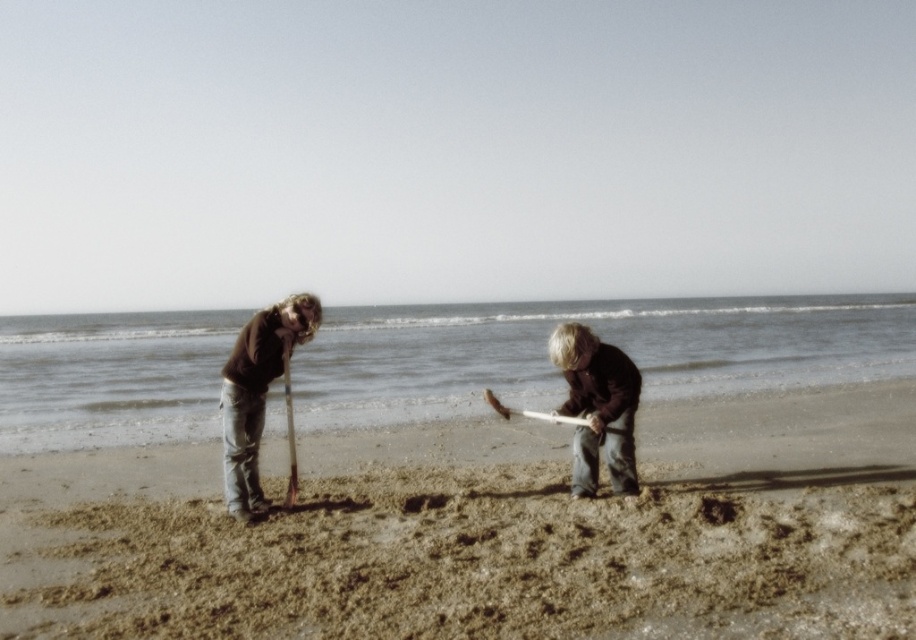
You are standing on the beach and see two points marked on the sand. The first point is at coordinates point (x=614, y=438) and the second is at point (x=249, y=465). If you were to walk from the first point to the second, would you be moving towards the ocean or away from it?

Since point (x=614, y=438) is in front of point (x=249, y=465), this means the first point is closer to the observer. Therefore, moving from the first point to the second would be moving away from the ocean towards the land.

You are standing at the shoreline and looking towards the ocean. There are two points marked on the beach, point 1 at coordinates point (435, 483) and point 2 at coordinates point (243, 496). Which point is closer to you?

Point 2 at coordinates point (243, 496) is closer to you because it is closer to the camera than point 1 at coordinates point (435, 483).

You are a visitor at the beach and want to know if the wooden stick at center can be fully buried in the brown sandy beach at center. Based on their heights, can it be done?

The brown sandy beach at center is not as tall as the wooden stick at center, meaning the stick is taller. Therefore, the wooden stick at center cannot be fully buried in the brown sandy beach at center since the sand area isn